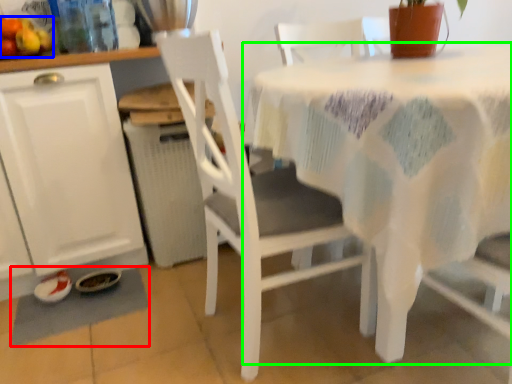
Question: Estimate the real-world distances between objects in this image. Which object is closer to place mat (highlighted by a red box), fruit (highlighted by a blue box) or table (highlighted by a green box)?

Choices:
 (A) fruit
 (B) table

Answer: (A)